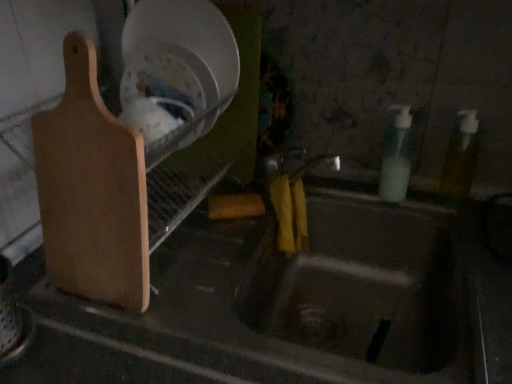
Question: From a real-world perspective, is light brown wood cutting board at left positioned under metallic sink at center based on gravity?

Choices:
 (A) yes
 (B) no

Answer: (B)

Question: Does light brown wood cutting board at left lie in front of metallic sink at center?

Choices:
 (A) yes
 (B) no

Answer: (A)

Question: Is light brown wood cutting board at left positioned with its back to metallic sink at center?

Choices:
 (A) yes
 (B) no

Answer: (B)

Question: Is metallic sink at center completely or partially inside light brown wood cutting board at left?

Choices:
 (A) yes
 (B) no

Answer: (B)

Question: Is light brown wood cutting board at left located outside metallic sink at center?

Choices:
 (A) yes
 (B) no

Answer: (A)

Question: Is light brown wood cutting board at left taller than metallic sink at center?

Choices:
 (A) yes
 (B) no

Answer: (A)

Question: Is translucent plastic soap dispenser at right, which is the first bottle in left-to-right order, wider than translucent yellow bottle at right, the 2th bottle when ordered from left to right?

Choices:
 (A) yes
 (B) no

Answer: (A)

Question: Would you say translucent plastic soap dispenser at right, which is the first bottle in left-to-right order, is a long distance from translucent yellow bottle at right, the 2th bottle when ordered from left to right?

Choices:
 (A) yes
 (B) no

Answer: (B)

Question: Is the position of translucent plastic soap dispenser at right, which ranks as the second bottle in right-to-left order, more distant than that of translucent yellow bottle at right, the 2th bottle when ordered from left to right?

Choices:
 (A) yes
 (B) no

Answer: (A)

Question: Is translucent plastic soap dispenser at right, which is the first bottle in left-to-right order, positioned in front of translucent yellow bottle at right, the 2th bottle when ordered from left to right?

Choices:
 (A) yes
 (B) no

Answer: (B)

Question: Would you say translucent plastic soap dispenser at right, which ranks as the second bottle in right-to-left order, is outside translucent yellow bottle at right, the 2th bottle when ordered from left to right?

Choices:
 (A) no
 (B) yes

Answer: (B)

Question: Can you confirm if translucent plastic soap dispenser at right, which is the first bottle in left-to-right order, is taller than translucent yellow bottle at right, the 2th bottle when ordered from left to right?

Choices:
 (A) yes
 (B) no

Answer: (A)

Question: From a real-world perspective, is metallic sink at center under light brown wood cutting board at left?

Choices:
 (A) no
 (B) yes

Answer: (B)